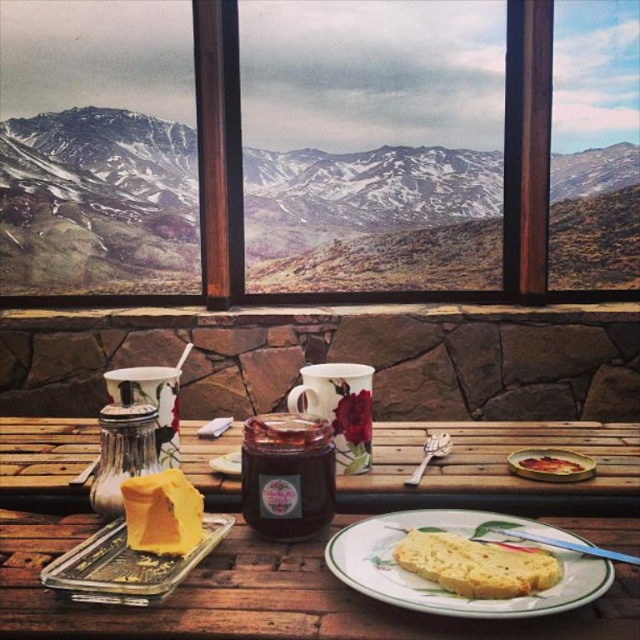
Is white glossy plate at center to the right of dark brown glass jar at center from the viewer's perspective?

Yes, white glossy plate at center is to the right of dark brown glass jar at center.

Which is behind, point (337, 561) or point (330, 438)?

The point (330, 438) is behind.

Is point (342, 579) positioned behind point (305, 436)?

No.

Identify the location of white glossy plate at center. The height and width of the screenshot is (640, 640). (444, 588).

Does point (256, 486) lie in front of point (552, 452)?

Yes.

Who is lower down, dark brown glass jar at center or shiny red jam jar at center?

shiny red jam jar at center

Between point (307, 502) and point (589, 461), which one is positioned in front?

Point (307, 502) is more forward.

You are a GUI agent. You are given a task and a screenshot of the screen. Output one action in this format:
    pyautogui.click(x=<x>, y=<y>)
    Task: Click on the dark brown glass jar at center
    
    Given the screenshot: What is the action you would take?
    pyautogui.click(x=285, y=476)

Is transparent glass window at center shorter than translucent glass jar at lower left?

No, transparent glass window at center is not shorter than translucent glass jar at lower left.

Does transparent glass window at center appear over translucent glass jar at lower left?

Yes.

The image size is (640, 640). What are the coordinates of `transparent glass window at center` in the screenshot? It's located at (362, 289).